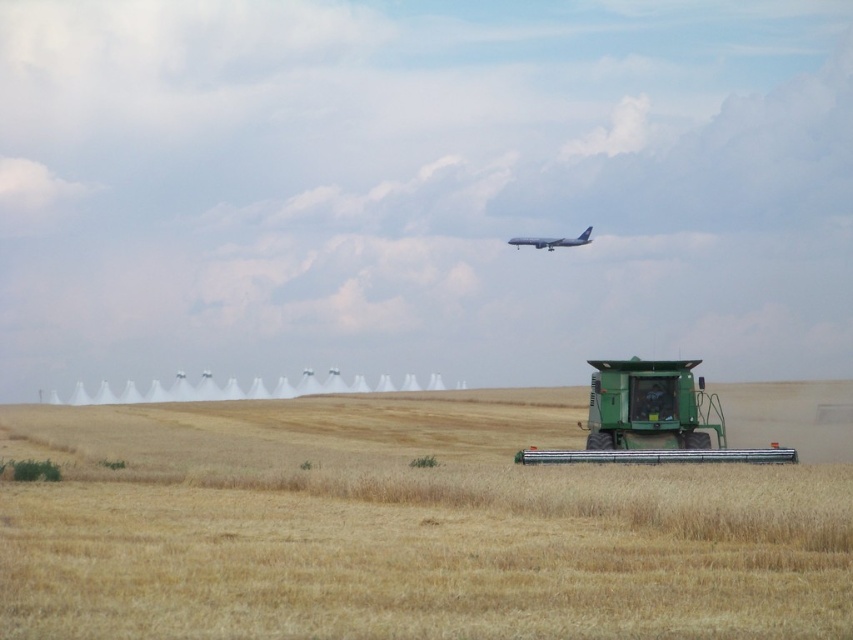
Consider the image. Can you confirm if green matte combine at lower right is bigger than white matte airplane at upper center?

No.

Who is positioned more to the left, green matte combine at lower right or white matte airplane at upper center?

green matte combine at lower right

Does point (589, 416) come behind point (512, 243)?

No, (589, 416) is closer to viewer.

Locate an element on the screen. Image resolution: width=853 pixels, height=640 pixels. green matte combine at lower right is located at coordinates (653, 419).

Who is shorter, golden matte wheat field at center or green matte combine at lower right?

green matte combine at lower right is shorter.

Identify the location of golden matte wheat field at center. (418, 522).

Where is `golden matte wheat field at center`? Image resolution: width=853 pixels, height=640 pixels. golden matte wheat field at center is located at coordinates (418, 522).

Between golden matte wheat field at center and white matte airplane at upper center, which one has less height?

white matte airplane at upper center

Who is more forward, (x=299, y=497) or (x=552, y=248)?

Point (x=299, y=497) is in front.

This screenshot has height=640, width=853. What are the coordinates of `golden matte wheat field at center` in the screenshot? It's located at (418, 522).